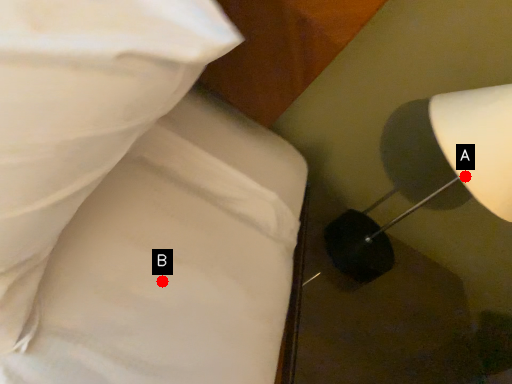
Question: Two points are circled on the image, labeled by A and B beside each circle. Which point is closer to the camera taking this photo?

Choices:
 (A) A is closer
 (B) B is closer

Answer: (B)